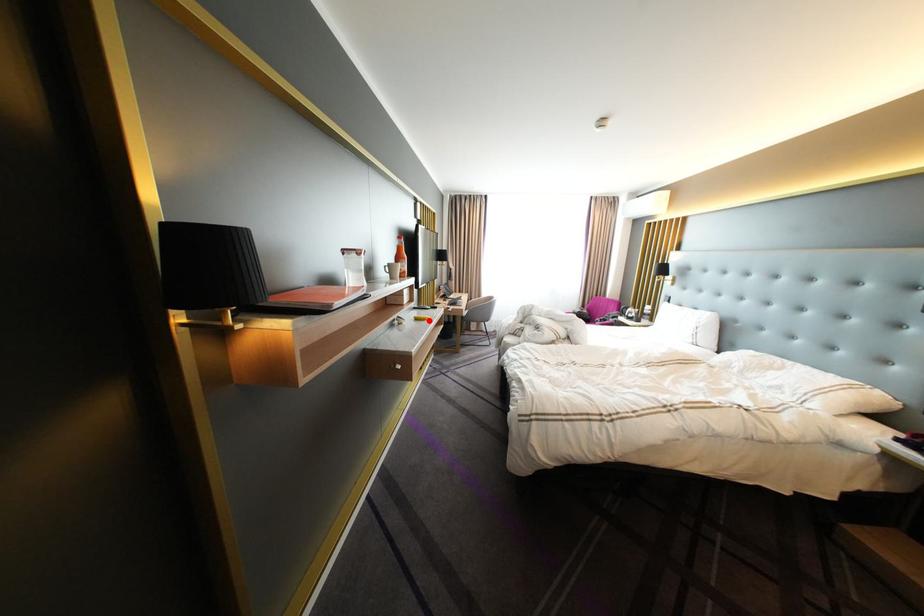
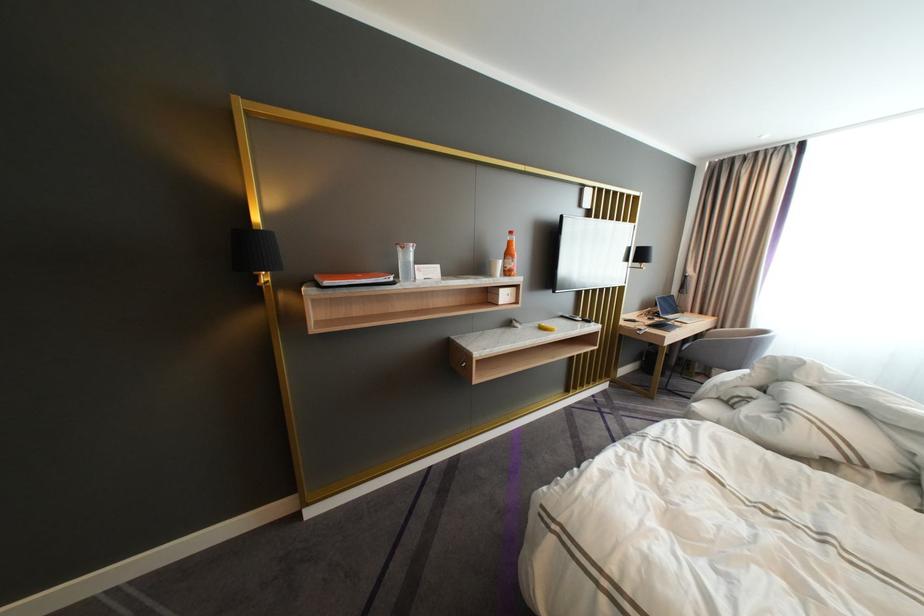
Where in the second image is the point corresponding to the highlighted location from the first image?

(553, 329)